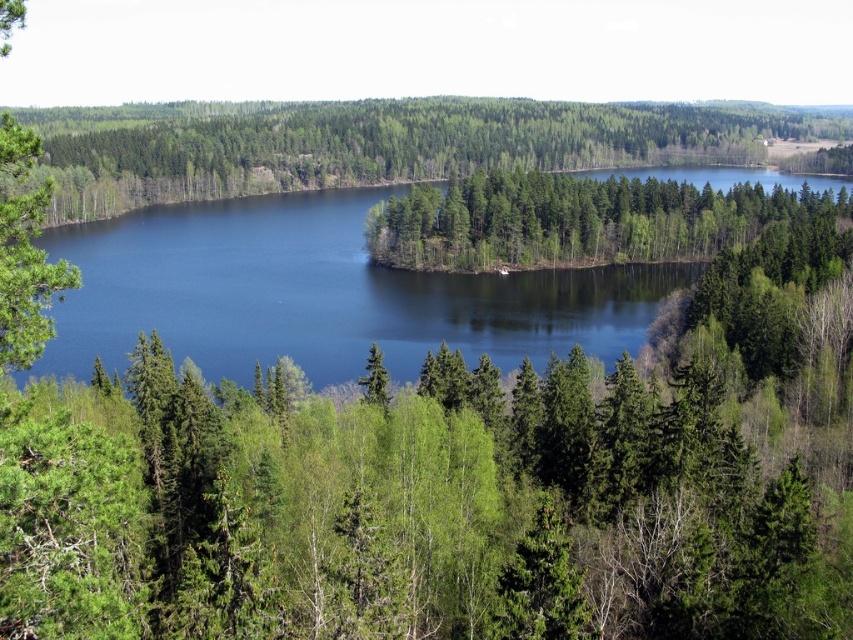
Question: Which object is farther from the camera taking this photo?

Choices:
 (A) green matte tree at left
 (B) blue water at center
 (C) green leafy trees at center

Answer: (C)

Question: Does green leafy trees at center have a smaller size compared to green matte tree at left?

Choices:
 (A) yes
 (B) no

Answer: (A)

Question: From the image, what is the correct spatial relationship of green leafy trees at center in relation to green matte tree at left?

Choices:
 (A) right
 (B) left

Answer: (A)

Question: Estimate the real-world distances between objects in this image. Which object is farther from the green leafy trees at center?

Choices:
 (A) green matte tree at left
 (B) blue water at center

Answer: (A)

Question: Is blue water at center further to the viewer compared to green leafy trees at center?

Choices:
 (A) yes
 (B) no

Answer: (B)

Question: Which object is closer to the camera taking this photo?

Choices:
 (A) green leafy trees at center
 (B) green matte tree at left
 (C) blue water at center

Answer: (B)